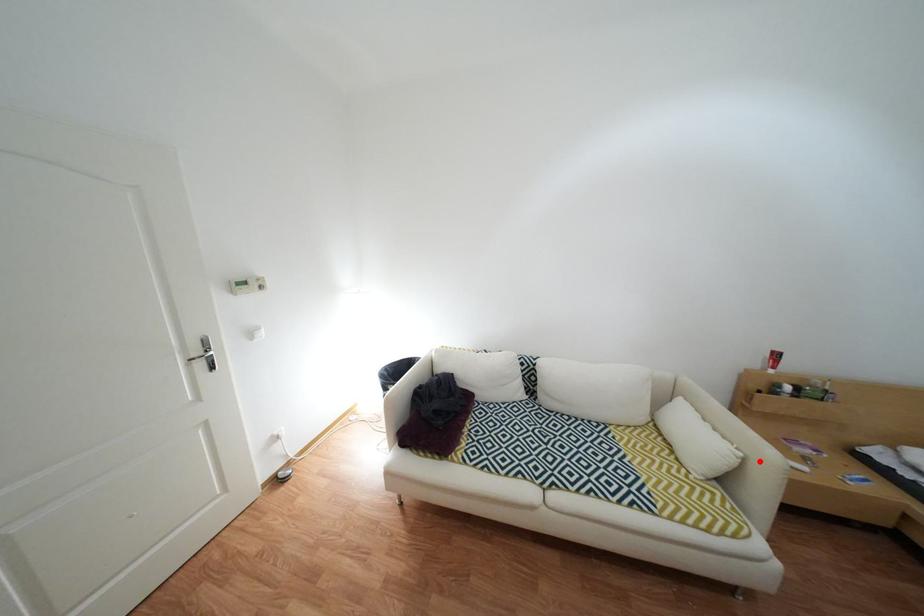
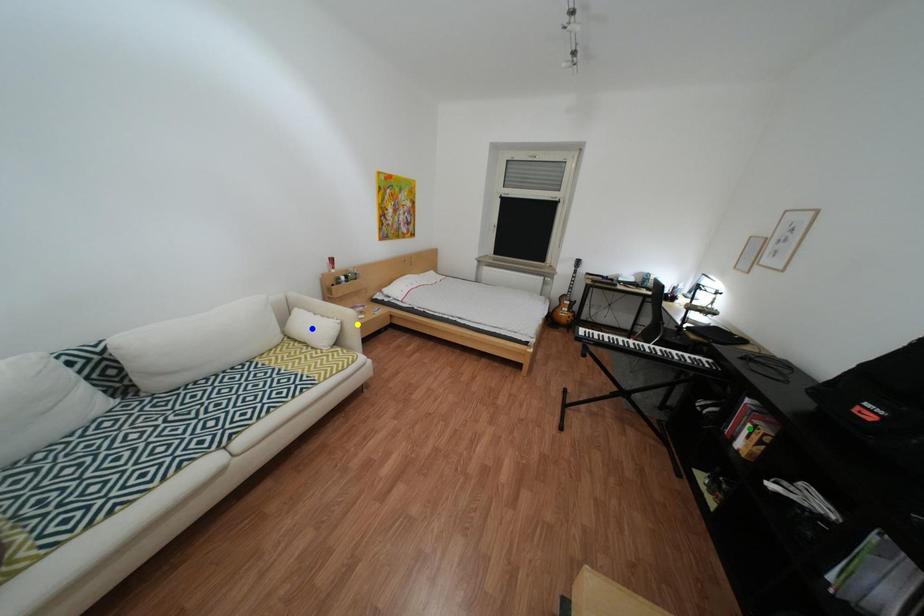
Question: I am providing you with two images of the same scene from different viewpoints. A red point is marked on the first image. You are given multiple points on the second image. Which point in image 2 represents the same 3d spot as the red point in image 1?

Choices:
 (A) green point
 (B) blue point
 (C) yellow point

Answer: (C)